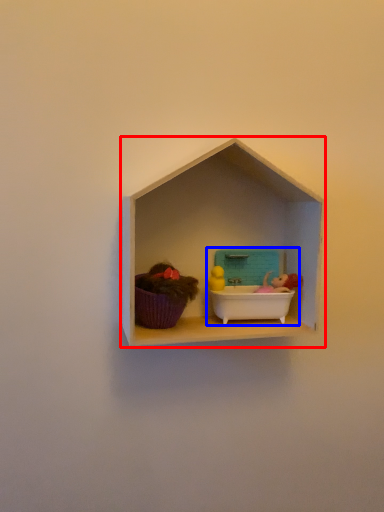
Question: Which object appears closest to the camera in this image, shelf (highlighted by a red box) or lunch box (highlighted by a blue box)?

Choices:
 (A) shelf
 (B) lunch box

Answer: (A)